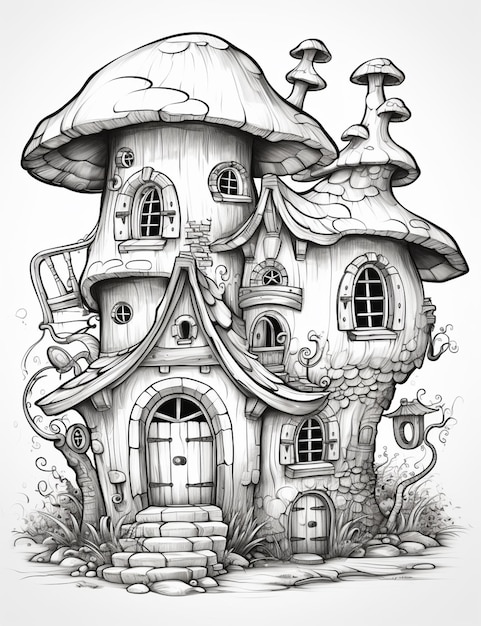
Identify the location of small door. This screenshot has width=481, height=626. (304, 531).